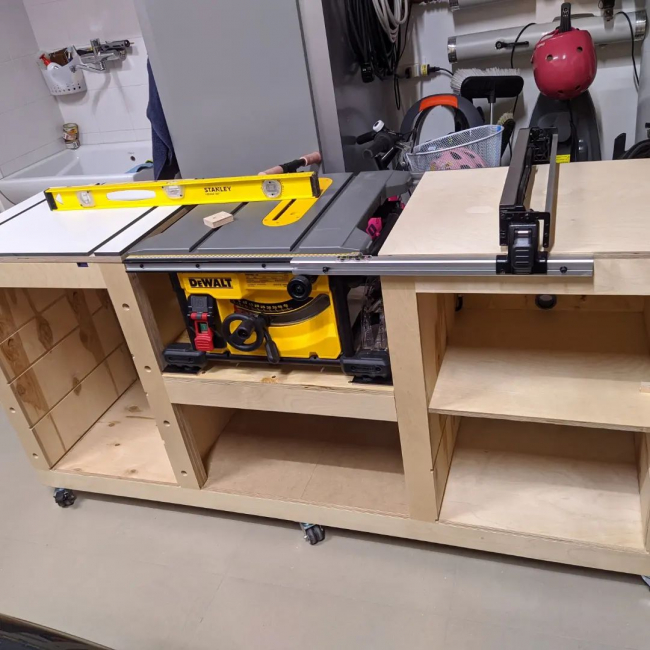
The image size is (650, 650). What are the coordinates of `knob` in the screenshot? It's located at (242, 333).